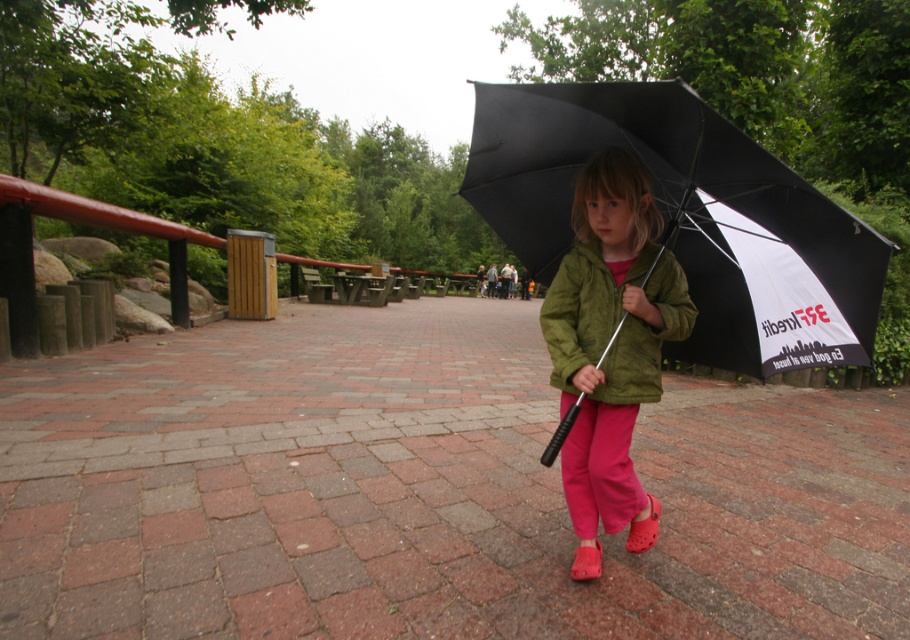
Question: Which is farther from the green suede jacket at center?

Choices:
 (A) black matte umbrella at center
 (B) matte green jacket at center

Answer: (A)

Question: Can you confirm if black matte umbrella at center is positioned above green suede jacket at center?

Choices:
 (A) yes
 (B) no

Answer: (A)

Question: Which object appears closest to the camera in this image?

Choices:
 (A) green suede jacket at center
 (B) matte green jacket at center

Answer: (B)

Question: Does black matte umbrella at center come in front of matte green jacket at center?

Choices:
 (A) yes
 (B) no

Answer: (A)

Question: Is matte green jacket at center thinner than green suede jacket at center?

Choices:
 (A) yes
 (B) no

Answer: (A)

Question: Based on their relative distances, which object is nearer to the green suede jacket at center?

Choices:
 (A) black matte umbrella at center
 (B) matte green jacket at center

Answer: (B)